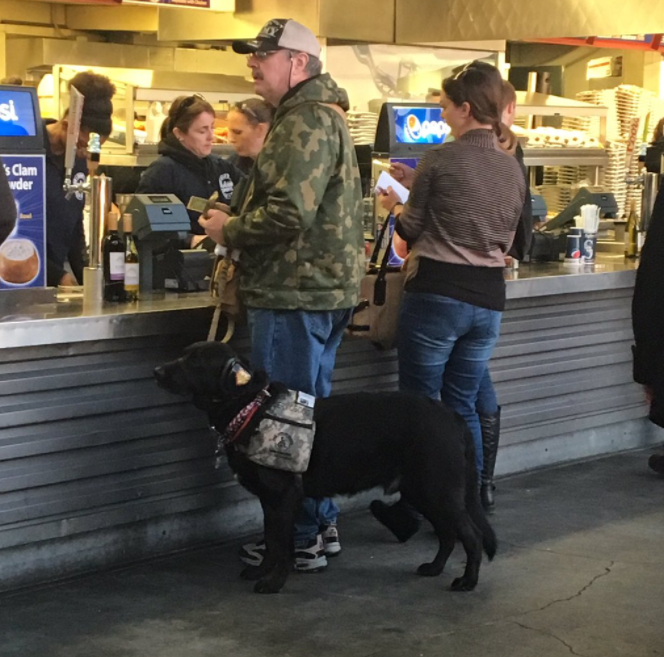
At what (x,y) coordinates should I click in order to perform the action: click on drink holders. Please return your answer as a coordinate pair (x, y). Looking at the image, I should click on (631, 101), (570, 173).